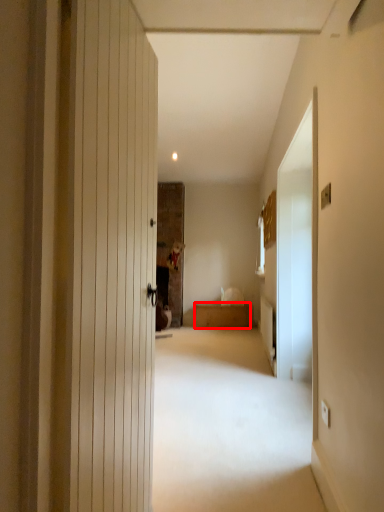
Question: Considering the relative positions of furniture (annotated by the red box) and screen door in the image provided, where is furniture (annotated by the red box) located with respect to the staircase?

Choices:
 (A) right
 (B) left

Answer: (B)